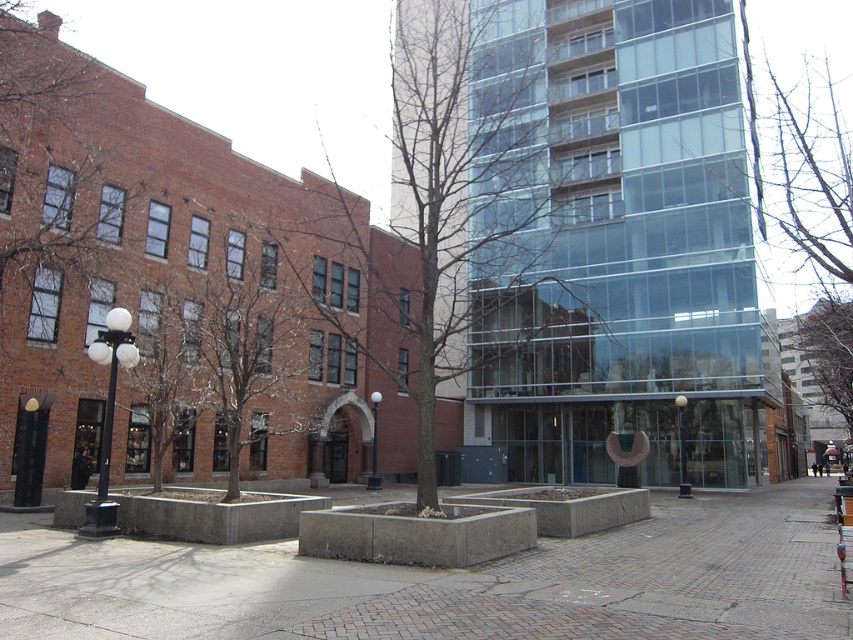
Is brown textured tree at upper left thinner than brown textured tree at center?

Indeed, brown textured tree at upper left has a lesser width compared to brown textured tree at center.

Is brown textured tree at upper left in front of brown textured tree at center?

No, it is not.

Between point (100, 240) and point (260, 310), which one is positioned behind?

The point (260, 310) is behind.

I want to click on brown textured tree at upper left, so click(53, 163).

Between point (482, 68) and point (134, 408), which one is positioned behind?

The point (482, 68) is behind.

Does point (428, 77) lie behind point (189, 348)?

Yes, point (428, 77) is behind point (189, 348).

Is point (500, 225) farther from viewer compared to point (160, 410)?

Yes.

Image resolution: width=853 pixels, height=640 pixels. In order to click on brown bark tree at center in this screenshot , I will do `click(469, 195)`.

Does bare branches at upper center have a lesser height compared to brown textured tree at center?

Incorrect, bare branches at upper center's height does not fall short of brown textured tree at center's.

Is point (792, 376) in front of point (250, 301)?

No.

In order to click on bare branches at upper center in this screenshot , I will do `click(805, 172)`.